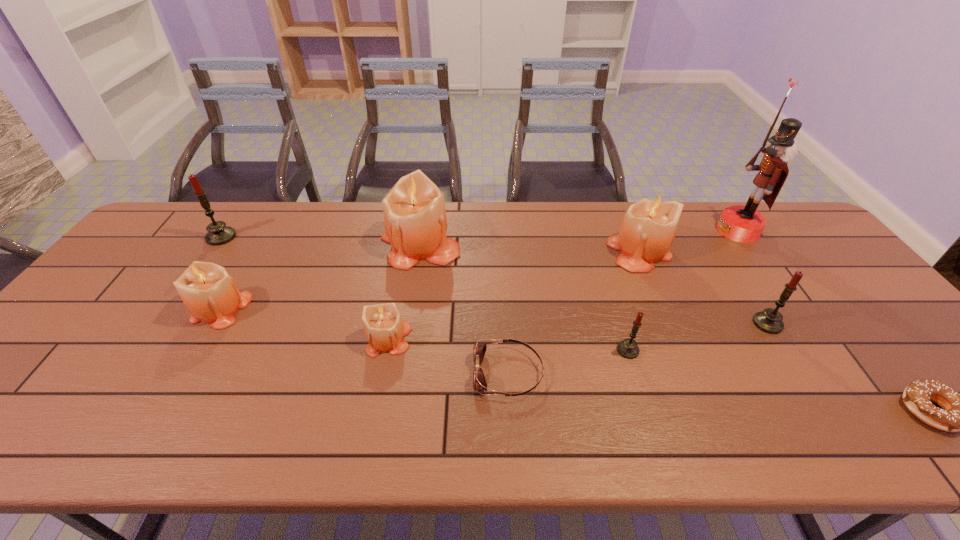
Locate an element on the screen. This screenshot has width=960, height=540. the second candle from left to right is located at coordinates (209, 293).

I want to click on the smallest red candle, so click(628, 348).

Locate an element on the screen. This screenshot has width=960, height=540. the second red candle from left to right is located at coordinates (628, 348).

Where is `the smallest beige candle`? This screenshot has height=540, width=960. the smallest beige candle is located at coordinates (384, 328).

The width and height of the screenshot is (960, 540). I want to click on the fifth object from left to right, so click(x=479, y=382).

The height and width of the screenshot is (540, 960). I want to click on vacant space situated 0.100m on the front-facing side of the tallest object, so click(686, 231).

What are the coordinates of `free space located 0.350m on the front-facing side of the tallest object` in the screenshot? It's located at (609, 231).

Where is `vacant region located 0.270m on the front-facing side of the tallest object`? vacant region located 0.270m on the front-facing side of the tallest object is located at coordinates (634, 231).

Where is `free spot located 0.250m on the right of the biggest beige candle`? free spot located 0.250m on the right of the biggest beige candle is located at coordinates (541, 246).

The width and height of the screenshot is (960, 540). What are the coordinates of `vacant region located on the front of the leftmost object` in the screenshot? It's located at (207, 256).